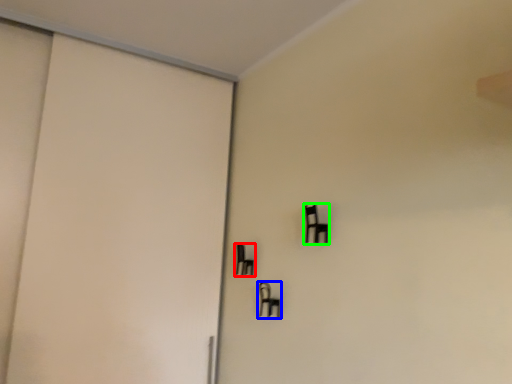
Question: Based on their relative distances, which object is nearer to furniture (highlighted by a red box)? Choose from furniture (highlighted by a blue box) and furniture (highlighted by a green box).

Choices:
 (A) furniture
 (B) furniture

Answer: (A)